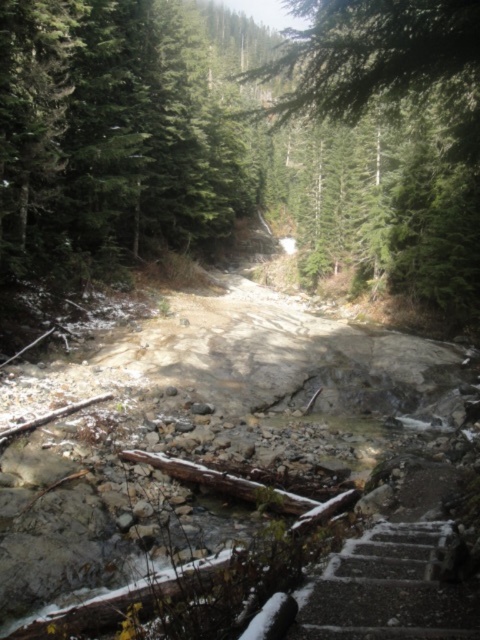
Can you confirm if brown rocky dirt track at center is positioned above dark gray concrete stairs at lower right?

Yes, brown rocky dirt track at center is above dark gray concrete stairs at lower right.

This screenshot has width=480, height=640. What do you see at coordinates (233, 467) in the screenshot?
I see `brown rocky dirt track at center` at bounding box center [233, 467].

Find the location of a particular element. The height and width of the screenshot is (640, 480). brown rocky dirt track at center is located at coordinates (233, 467).

Is brown rocky dirt track at center positioned behind green matte tree at center?

That is False.

Between point (288, 380) and point (395, 280), which one is positioned behind?

Positioned behind is point (395, 280).

Which is behind, point (437, 477) or point (442, 307)?

Point (442, 307)

I want to click on brown rocky dirt track at center, so click(x=233, y=467).

Who is more forward, (x=464, y=16) or (x=376, y=524)?

Point (x=464, y=16)

Is green matte tree at center taller than dark gray concrete stairs at lower right?

Yes.

Locate an element on the screen. green matte tree at center is located at coordinates (398, 113).